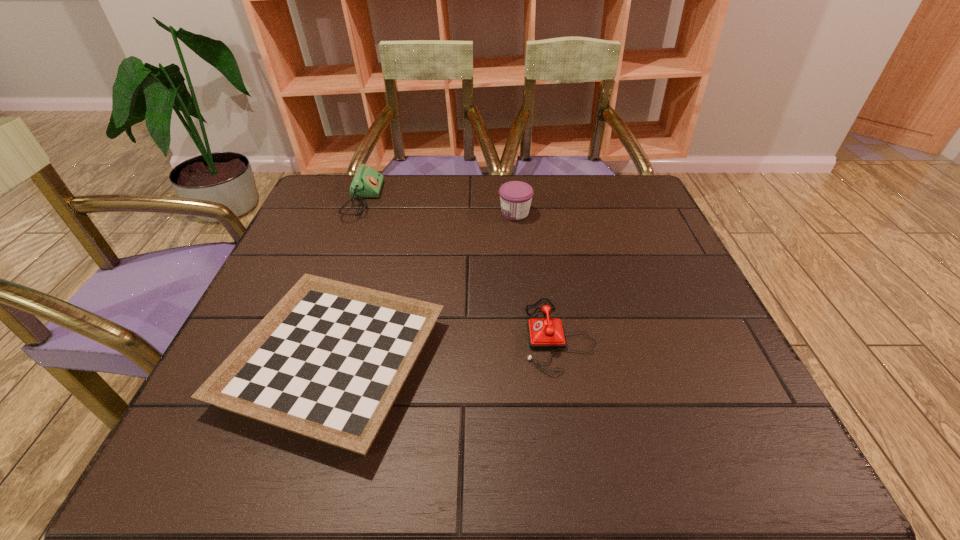
You are a GUI agent. You are given a task and a screenshot of the screen. Output one action in this format:
    pyautogui.click(x=<x>, y=<y>)
    Task: Click on the vacant space at the far edge of the desktop
    
    Given the screenshot: What is the action you would take?
    pyautogui.click(x=517, y=220)

Where is `vacant region at the near edge of the desktop`? This screenshot has width=960, height=540. vacant region at the near edge of the desktop is located at coordinates (599, 471).

In the image, there is a desktop. In order to click on free space at the left edge in this screenshot , I will do `click(260, 291)`.

Find the location of `free space at the right edge of the desktop`. free space at the right edge of the desktop is located at coordinates (750, 418).

Image resolution: width=960 pixels, height=540 pixels. I want to click on vacant position at the far left corner of the desktop, so click(324, 210).

In the image, there is a desktop. Where is `free space at the near left corner`? Image resolution: width=960 pixels, height=540 pixels. free space at the near left corner is located at coordinates (275, 439).

The height and width of the screenshot is (540, 960). Identify the location of vacant space at the far right corner of the desktop. (637, 208).

At what (x,y) coordinates should I click in order to perform the action: click on vacant space at the near right corner of the desktop. Please return your answer as a coordinate pair (x, y). Looking at the image, I should click on (695, 452).

Where is `unoccupied position between the shortest object and the farther telephone`? This screenshot has height=540, width=960. unoccupied position between the shortest object and the farther telephone is located at coordinates (348, 281).

Find the location of a particular element. This screenshot has width=960, height=540. empty space between the farther telephone and the shortest object is located at coordinates (348, 281).